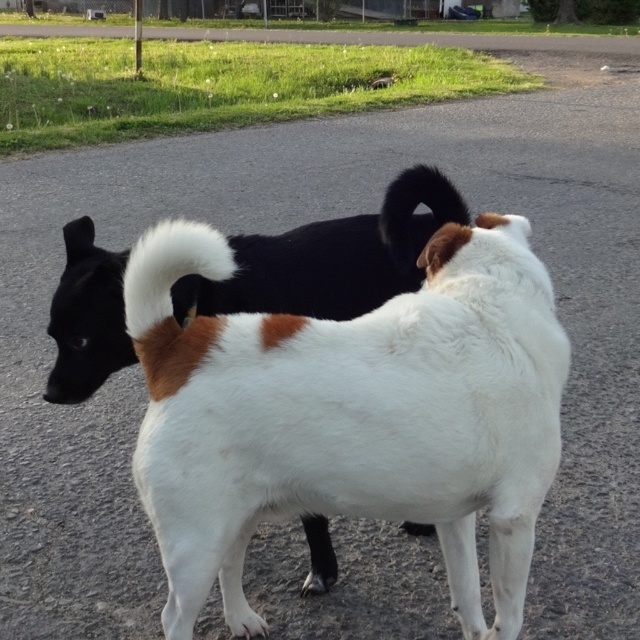
Does white fur dog at center appear under black fur tail at upper center?

Yes, white fur dog at center is below black fur tail at upper center.

Can you confirm if white fur dog at center is taller than black fur tail at upper center?

Correct, white fur dog at center is much taller as black fur tail at upper center.

Locate an element on the screen. The width and height of the screenshot is (640, 640). white fur dog at center is located at coordinates (307, 273).

Identify the location of white fur dog at center. The height and width of the screenshot is (640, 640). (307, 273).